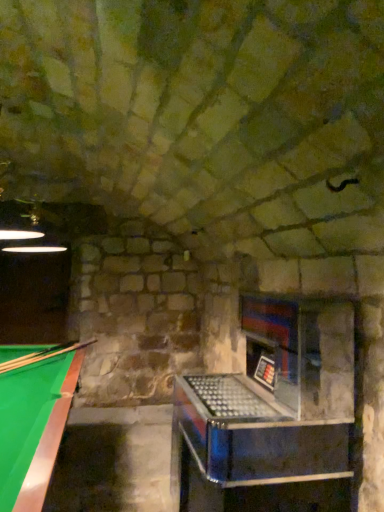
Question: From the image's perspective, is green felt billiard table at lower left positioned above or below wooden smooth cue at left?

Choices:
 (A) above
 (B) below

Answer: (B)

Question: From their relative heights in the image, would you say green felt billiard table at lower left is taller or shorter than wooden smooth cue at left?

Choices:
 (A) short
 (B) tall

Answer: (B)

Question: Looking at the image, does green felt billiard table at lower left seem bigger or smaller compared to wooden smooth cue at left?

Choices:
 (A) small
 (B) big

Answer: (B)

Question: Based on their sizes in the image, would you say wooden smooth cue at left is bigger or smaller than green felt billiard table at lower left?

Choices:
 (A) small
 (B) big

Answer: (A)

Question: Is point (94, 340) closer or farther from the camera than point (46, 454)?

Choices:
 (A) farther
 (B) closer

Answer: (A)

Question: Considering the positions of wooden smooth cue at left and green felt billiard table at lower left in the image, is wooden smooth cue at left taller or shorter than green felt billiard table at lower left?

Choices:
 (A) short
 (B) tall

Answer: (A)

Question: Considering the relative positions of wooden smooth cue at left and green felt billiard table at lower left in the image provided, is wooden smooth cue at left to the left or to the right of green felt billiard table at lower left?

Choices:
 (A) left
 (B) right

Answer: (B)